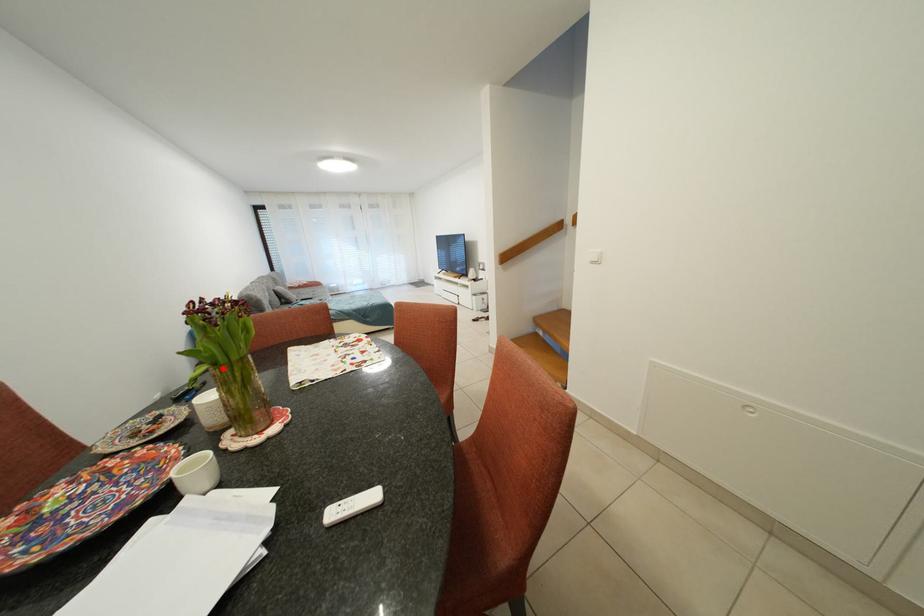
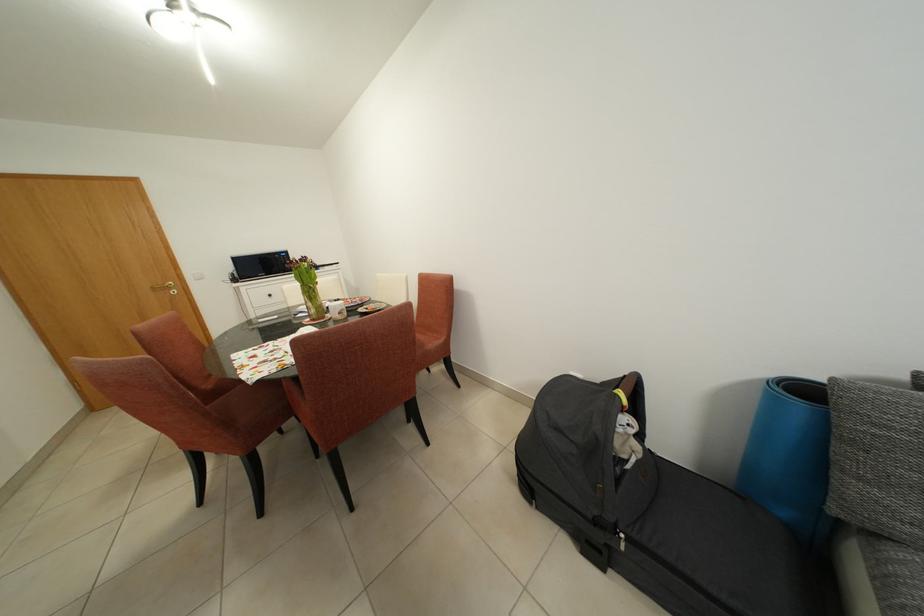
Question: I am providing you with two images of the same scene from different viewpoints. A red point is shown in image1. For the corresponding object point in image2, is it positioned nearer or farther from the camera?

Choices:
 (A) Nearer
 (B) Farther

Answer: (A)